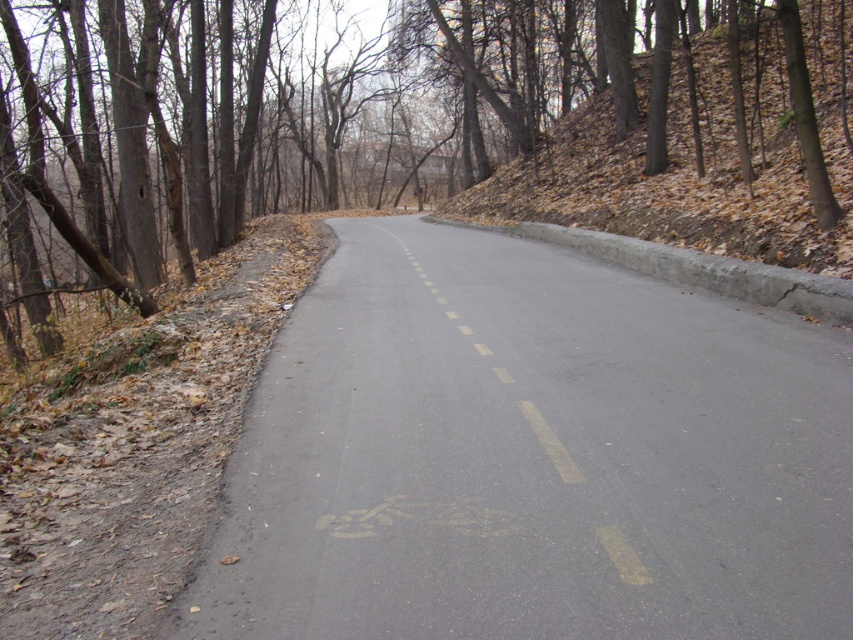
You are driving a car and see two points on the road ahead. The first point is at coordinate point (x=537, y=413) and the second is at point (x=260, y=60). Which point is closer to your current position?

Point (x=260, y=60) is closer to your current position because it is behind point (x=537, y=413), which is in front of it.

You are driving a car and see the asphalt road at center and the brown bark tree at center in your view. Which one is closer to your car?

The asphalt road at center is closer to your car because it is in front of the brown bark tree at center.

You are a hiker standing at the edge of the asphalt road at center. You notice a brown bark tree at center in front of you. Which object is taller?

The brown bark tree at center is taller than the asphalt road at center.